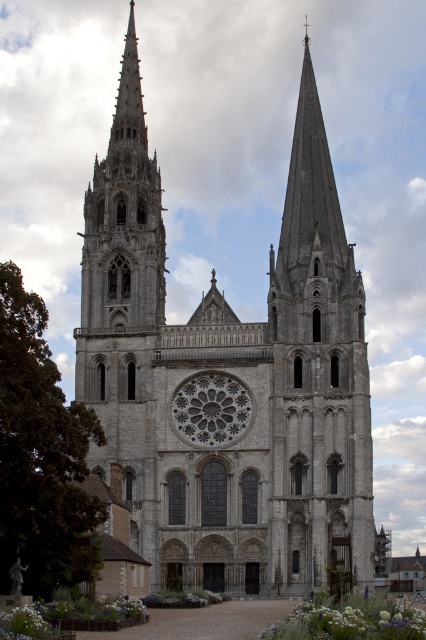
Question: Does gray stone church at center appear under gray stone rose window at center?

Choices:
 (A) no
 (B) yes

Answer: (A)

Question: Does gray stone church at center have a lesser width compared to gray stone rose window at center?

Choices:
 (A) yes
 (B) no

Answer: (B)

Question: Is the position of gray stone church at center less distant than that of gray stone rose window at center?

Choices:
 (A) yes
 (B) no

Answer: (A)

Question: Which point appears closest to the camera in this image?

Choices:
 (A) pos(175,428)
 (B) pos(310,154)

Answer: (A)

Question: Among these points, which one is nearest to the camera?

Choices:
 (A) (203, 385)
 (B) (253, 516)

Answer: (B)

Question: Which of the following is the farthest from the observer?

Choices:
 (A) gray stone rose window at center
 (B) gray stone church at center

Answer: (A)